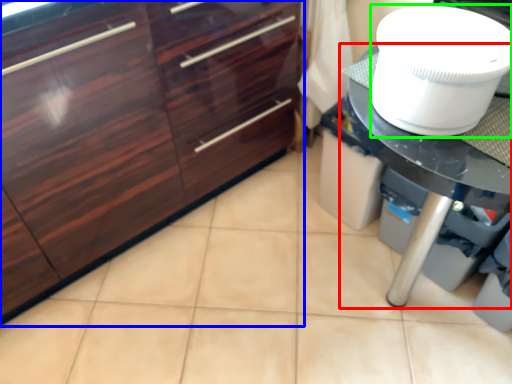
Question: Which object is positioned closest to countertop (highlighted by a red box)? Select from cabinetry (highlighted by a blue box) and toilet bowl (highlighted by a green box).

Choices:
 (A) cabinetry
 (B) toilet bowl

Answer: (B)